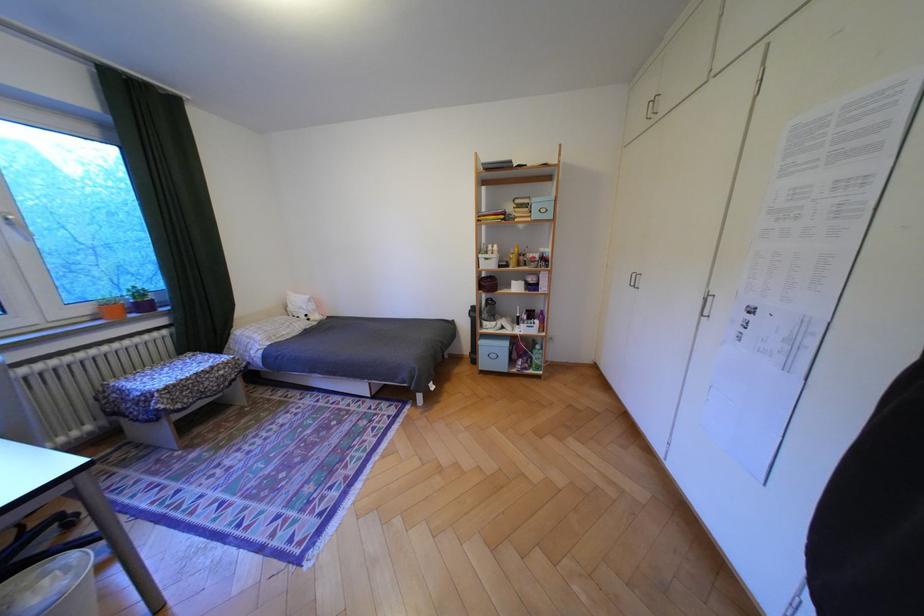
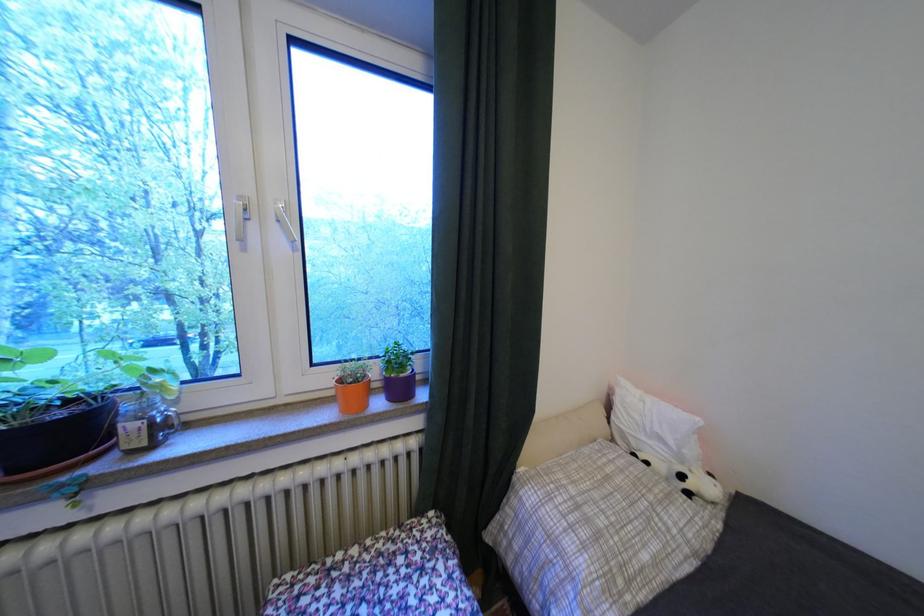
Find the pixel in the second image that matches the point at 300,334 in the first image.

(667, 562)